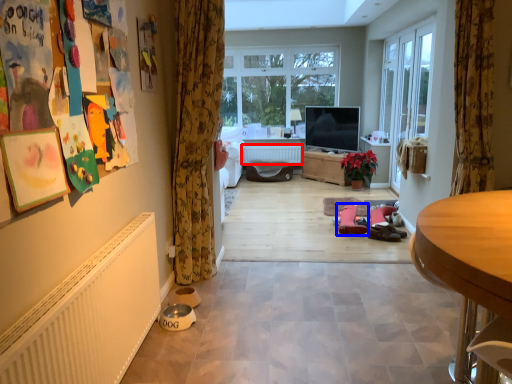
Question: Which of the following is the farthest to the observer, radiator (highlighted by a red box) or footwear (highlighted by a blue box)?

Choices:
 (A) radiator
 (B) footwear

Answer: (A)